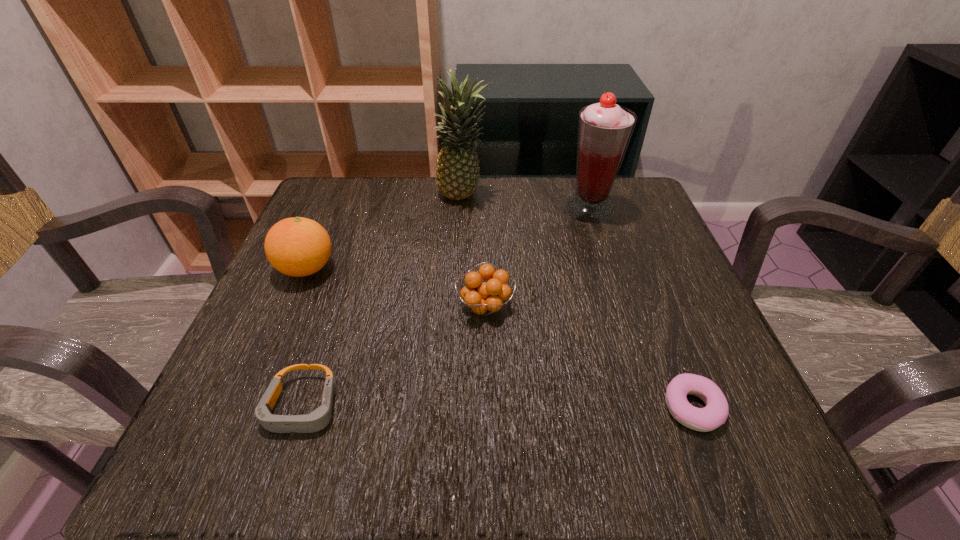
The width and height of the screenshot is (960, 540). What are the coordinates of `vacant space at the near right corner` in the screenshot? It's located at (727, 441).

Where is `free space between the fourth shortest object and the pastry`? This screenshot has width=960, height=540. free space between the fourth shortest object and the pastry is located at coordinates (499, 339).

The width and height of the screenshot is (960, 540). What are the coordinates of `empty location between the pineapple and the pastry` in the screenshot? It's located at (578, 302).

Where is `empty location between the taller orange fruit and the pineapple`? This screenshot has height=540, width=960. empty location between the taller orange fruit and the pineapple is located at coordinates (385, 233).

Where is `free spot between the left orange fruit and the shorter orange fruit`? The height and width of the screenshot is (540, 960). free spot between the left orange fruit and the shorter orange fruit is located at coordinates (396, 288).

Where is `free point between the goggles and the pastry`? free point between the goggles and the pastry is located at coordinates (497, 408).

Locate an element on the screen. This screenshot has height=540, width=960. empty space that is in between the shorter orange fruit and the pineapple is located at coordinates (474, 252).

Where is `free space between the goggles and the pastry`? This screenshot has width=960, height=540. free space between the goggles and the pastry is located at coordinates (497, 408).

Locate an element on the screen. Image resolution: width=960 pixels, height=540 pixels. free space between the pastry and the pineapple is located at coordinates (578, 302).

You are a GUI agent. You are given a task and a screenshot of the screen. Output one action in this format:
    pyautogui.click(x=<x>, y=<y>)
    Task: Click on the free spot between the left orange fruit and the third shortest object
    
    Given the screenshot: What is the action you would take?
    pyautogui.click(x=396, y=288)